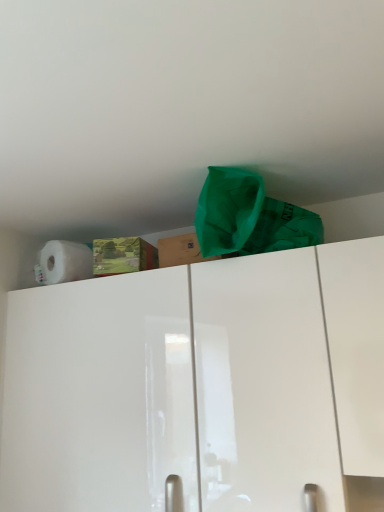
Question: Should I look upward or downward to see white matte paper towel at upper left?

Choices:
 (A) down
 (B) up

Answer: (A)

Question: Could you tell me if white matte paper towel at upper left is facing white glossy cabinet at upper center?

Choices:
 (A) yes
 (B) no

Answer: (B)

Question: Can you confirm if white matte paper towel at upper left is wider than white glossy cabinet at upper center?

Choices:
 (A) no
 (B) yes

Answer: (A)

Question: Is white glossy cabinet at upper center at the back of white matte paper towel at upper left?

Choices:
 (A) no
 (B) yes

Answer: (A)

Question: From a real-world perspective, does white matte paper towel at upper left stand above white glossy cabinet at upper center?

Choices:
 (A) yes
 (B) no

Answer: (A)

Question: Is white matte paper towel at upper left far from white glossy cabinet at upper center?

Choices:
 (A) yes
 (B) no

Answer: (B)

Question: Is white matte paper towel at upper left placed right next to white glossy cabinet at upper center?

Choices:
 (A) no
 (B) yes

Answer: (A)

Question: From the image's perspective, does brown cardboard box at upper center appear higher than white glossy cabinet at upper center?

Choices:
 (A) no
 (B) yes

Answer: (B)

Question: Can you confirm if brown cardboard box at upper center is thinner than white glossy cabinet at upper center?

Choices:
 (A) yes
 (B) no

Answer: (A)

Question: Can you confirm if brown cardboard box at upper center is taller than white glossy cabinet at upper center?

Choices:
 (A) yes
 (B) no

Answer: (B)

Question: Is brown cardboard box at upper center oriented towards white glossy cabinet at upper center?

Choices:
 (A) yes
 (B) no

Answer: (B)

Question: Is brown cardboard box at upper center closer to the viewer compared to white glossy cabinet at upper center?

Choices:
 (A) no
 (B) yes

Answer: (A)

Question: Is white glossy cabinet at upper center at the back of brown cardboard box at upper center?

Choices:
 (A) no
 (B) yes

Answer: (A)

Question: Are brown cardboard box at upper center and white matte paper towel at upper left making contact?

Choices:
 (A) yes
 (B) no

Answer: (B)